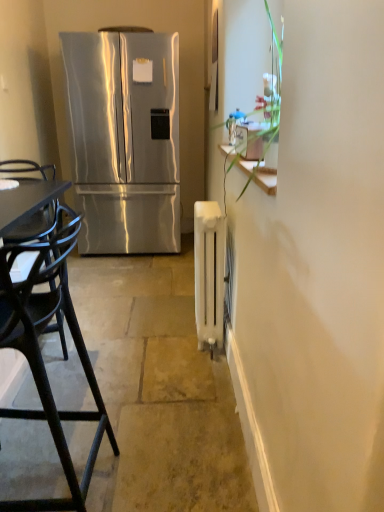
The width and height of the screenshot is (384, 512). I want to click on unoccupied space behind white matte radiator at center, so click(179, 315).